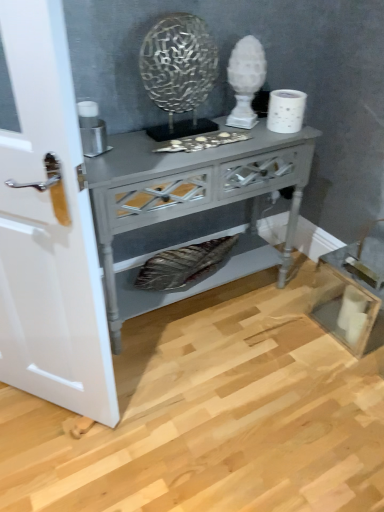
The image size is (384, 512). Identify the location of free space in front of white textured toilet paper at upper right. (271, 140).